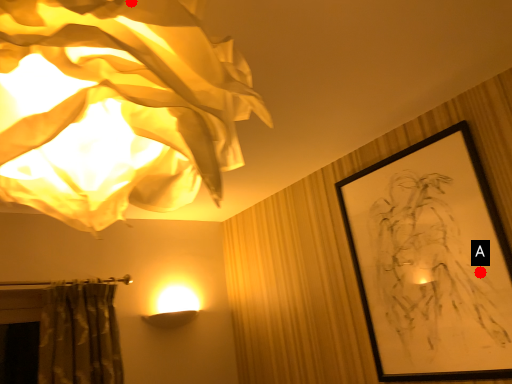
Question: Two points are circled on the image, labeled by A and B beside each circle. Which point is farther to the camera?

Choices:
 (A) A is further
 (B) B is further

Answer: (A)